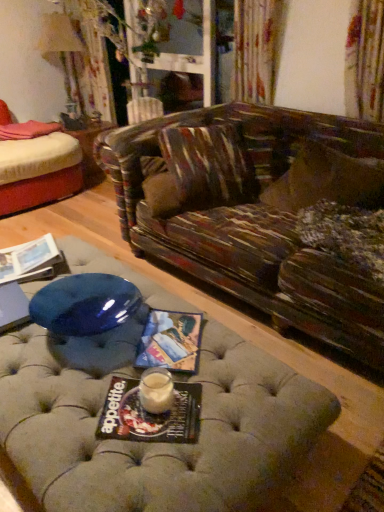
Identify the location of blank space above matte black magazine at center, arranged as the third magazine when viewed from the top (from a real-world perspective). This screenshot has height=512, width=384. (161, 406).